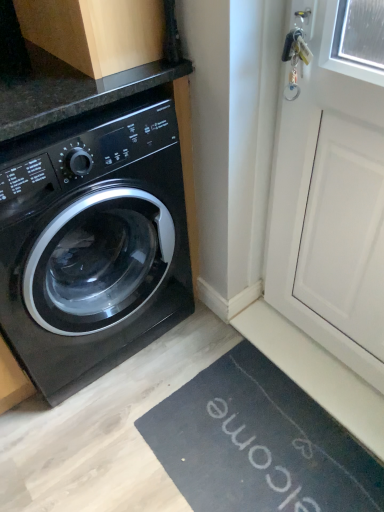
Question: From the image's perspective, is black glossy washing machine at left positioned above or below white matte screen door at upper right?

Choices:
 (A) above
 (B) below

Answer: (A)

Question: Based on their positions, is black glossy washing machine at left located to the left or right of white matte screen door at upper right?

Choices:
 (A) left
 (B) right

Answer: (A)

Question: Which object is positioned farthest from the white matte screen door at upper right?

Choices:
 (A) black rubber bath mat at lower right
 (B) black glossy washing machine at left
 (C) wooden cabinet at upper left

Answer: (C)

Question: Estimate the real-world distances between objects in this image. Which object is farther from the black rubber bath mat at lower right?

Choices:
 (A) wooden cabinet at upper left
 (B) white matte screen door at upper right
 (C) black glossy washing machine at left

Answer: (A)